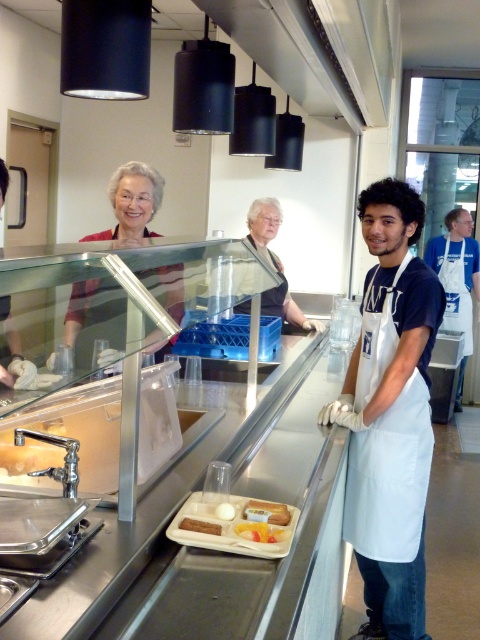
Question: Which point is farther from the camera taking this photo?

Choices:
 (A) (274, 218)
 (B) (273, 515)
 (C) (362, 300)

Answer: (A)

Question: Can you confirm if white matte apron at center is thinner than white apron at right?

Choices:
 (A) no
 (B) yes

Answer: (B)

Question: Estimate the real-world distances between objects in this image. Which object is closer to the smooth plastic tray at center?

Choices:
 (A) matte black apron at center
 (B) brown matte bread at center
 (C) yellow matte plastic tray at center
 (D) white apron at right

Answer: (C)

Question: Is white matte apron at center in front of matte black apron at center?

Choices:
 (A) no
 (B) yes

Answer: (B)

Question: Which point is farther from the camera taking this photo?

Choices:
 (A) (192, 518)
 (B) (226, 502)
 (C) (142, 164)
 (D) (377, 221)

Answer: (C)

Question: Where is matte black sweater at upper center located in relation to smooth plastic tray at center in the image?

Choices:
 (A) above
 (B) below

Answer: (A)